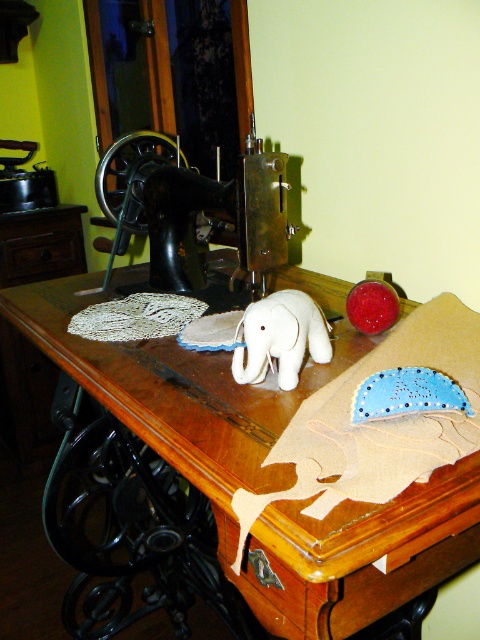
Is wooden sewing machine at center smaller than black metal sewing machine at center?

Actually, wooden sewing machine at center might be larger than black metal sewing machine at center.

Who is more forward, (273, 412) or (104, 188)?

Point (273, 412)

Measure the distance between point (158, 420) and camera.

79.17 centimeters

Image resolution: width=480 pixels, height=640 pixels. I want to click on wooden sewing machine at center, so click(x=262, y=468).

Can you confirm if wooden sewing machine at center is thinner than white plush elephant at center?

Incorrect, wooden sewing machine at center's width is not less than white plush elephant at center's.

Looking at this image, is wooden sewing machine at center positioned before white plush elephant at center?

Yes, wooden sewing machine at center is closer to the viewer.

Who is more distant from viewer, (149, 406) or (269, 324)?

The point (269, 324) is more distant.

Locate an element on the screen. This screenshot has height=640, width=480. wooden sewing machine at center is located at coordinates (262, 468).

Consider the image. Which of these two, black metal sewing machine at center or white plush elephant at center, stands shorter?

Standing shorter between the two is white plush elephant at center.

Does black metal sewing machine at center appear over white plush elephant at center?

Yes, black metal sewing machine at center is above white plush elephant at center.

Which is behind, point (145, 221) or point (309, 307)?

The point (145, 221) is more distant.

Identify the location of black metal sewing machine at center. This screenshot has height=640, width=480. (193, 209).